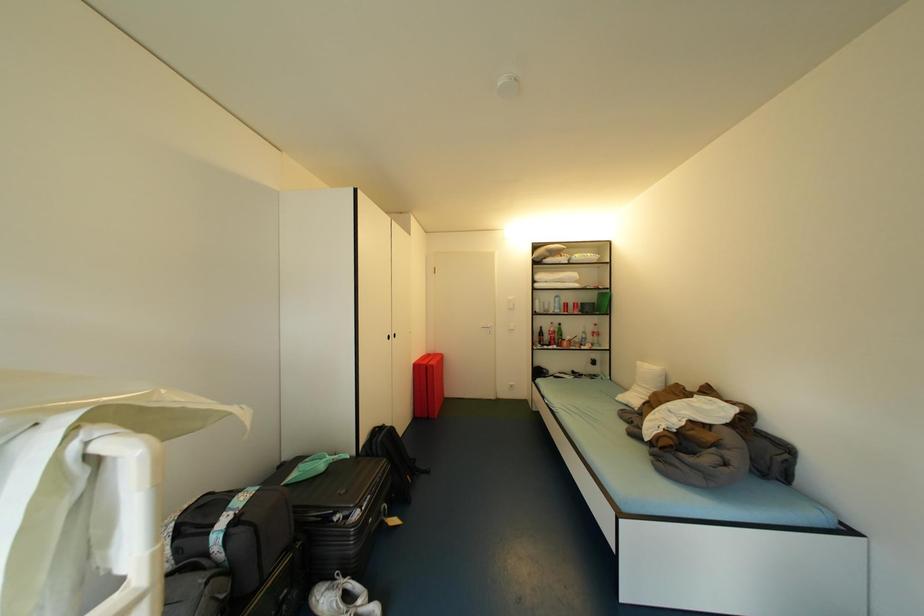
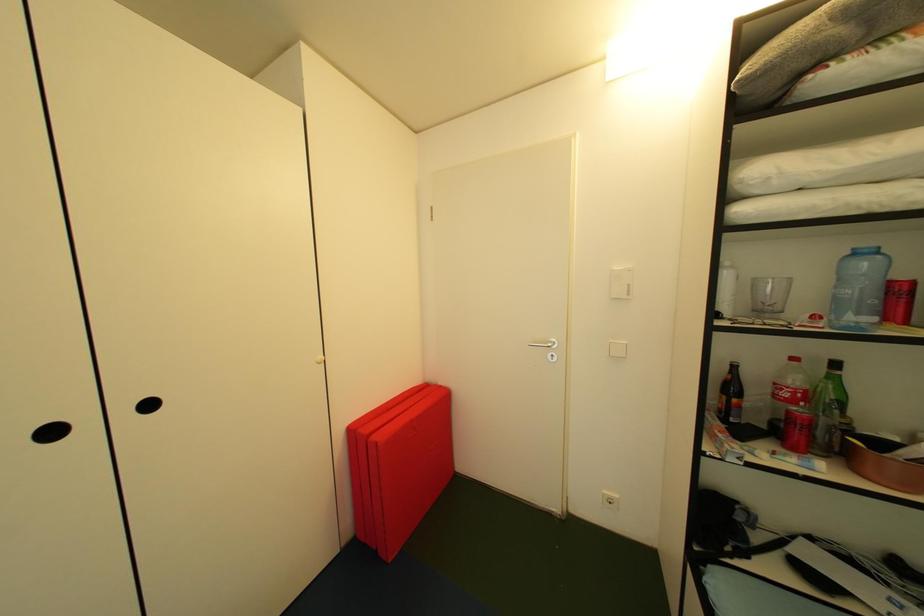
Question: Which direction would the cameraman need to move to produce the second image? Reply with the corresponding letter.

Choices:
 (A) Left
 (B) Right
 (C) Forward
 (D) Backward

Answer: (C)